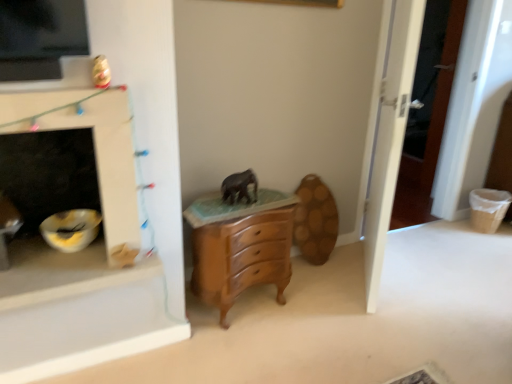
The height and width of the screenshot is (384, 512). I want to click on free point in front of matte gray elephant at center, so click(229, 210).